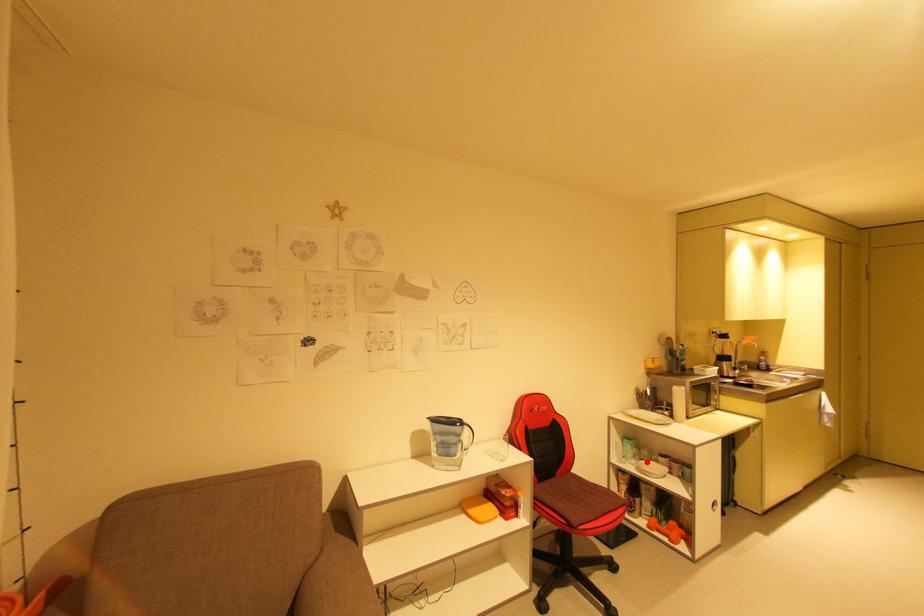
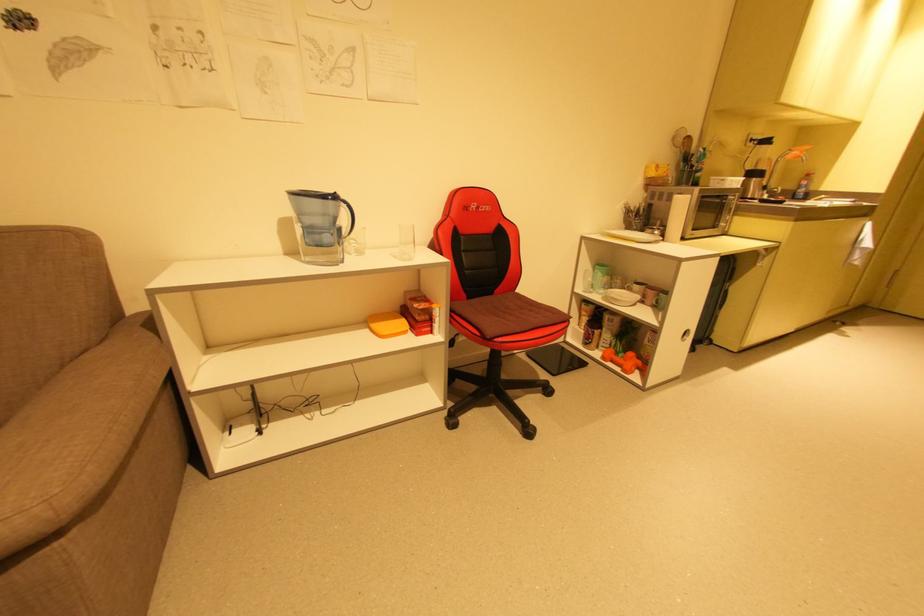
The point at the highlighted location is marked in the first image. Where is the corresponding point in the second image?

(616, 290)